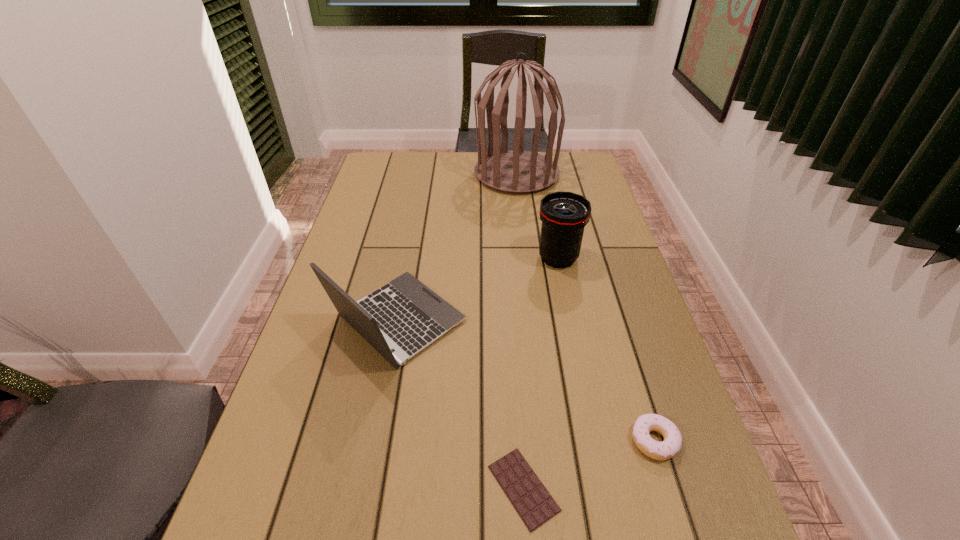
In the image, there is a desktop. Find the location of `vacant space at the left edge`. vacant space at the left edge is located at coordinates (396, 233).

Where is `free region at the right edge of the desktop`? free region at the right edge of the desktop is located at coordinates (600, 256).

I want to click on vacant space at the far left corner of the desktop, so click(398, 162).

Where is `vacant point located between the leftmost object and the farthest object`? vacant point located between the leftmost object and the farthest object is located at coordinates (457, 247).

At what (x,y) coordinates should I click in order to perform the action: click on unoccupied position between the laptop_computer and the telephoto lens. Please return your answer as a coordinate pair (x, y). Looking at the image, I should click on (477, 289).

What are the coordinates of `free space that is in between the chocolate bar and the farthest object` in the screenshot? It's located at (520, 331).

Where is `empty location between the third farthest object and the chocolate bar`? empty location between the third farthest object and the chocolate bar is located at coordinates (460, 404).

At what (x,y) coordinates should I click in order to perform the action: click on unoccupied position between the laptop_computer and the rightmost object. Please return your answer as a coordinate pair (x, y). The image size is (960, 540). Looking at the image, I should click on (526, 381).

Locate an element on the screen. empty location between the third nearest object and the shortest object is located at coordinates 460,404.

At what (x,y) coordinates should I click in order to perform the action: click on vacant space in between the shortest object and the rightmost object. Please return your answer as a coordinate pair (x, y). Looking at the image, I should click on [589, 464].